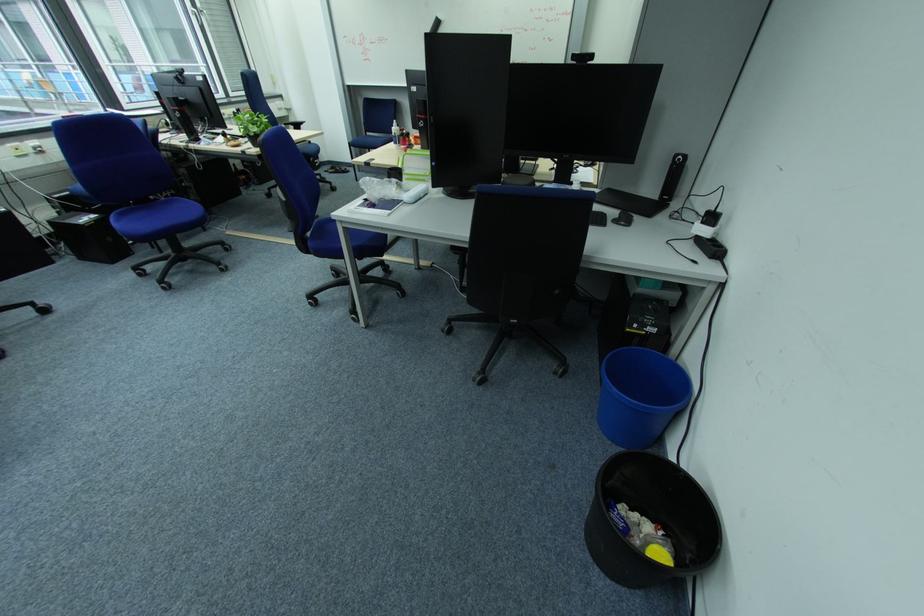
Where is `black chair sitting surface`? Image resolution: width=924 pixels, height=616 pixels. black chair sitting surface is located at coordinates (371, 140).